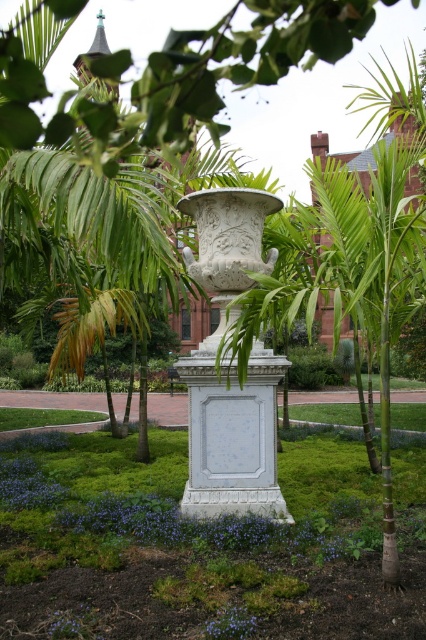
You are a gardener who wants to water the purple matte flower at lower left and the purple matte flower at center. Which flower should you water first if you want to start with the one nearest to you?

The purple matte flower at lower left is closer to the viewer, so you should water it first.